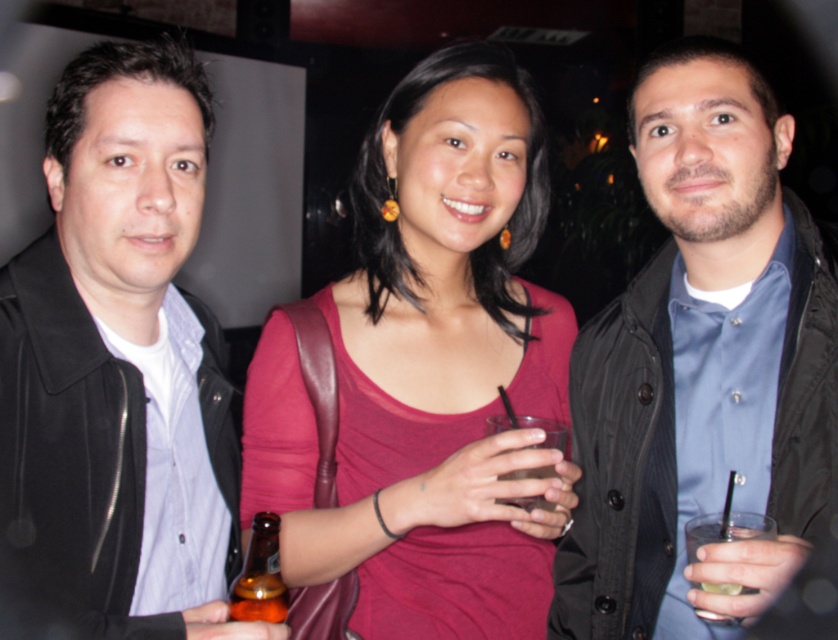
Which is behind, point (412, 448) or point (661, 252)?

The point (661, 252) is more distant.

Can you confirm if matte pink tank top at center is shorter than matte black jacket at center?

Correct, matte pink tank top at center is not as tall as matte black jacket at center.

What do you see at coordinates (428, 371) in the screenshot? I see `matte pink tank top at center` at bounding box center [428, 371].

The height and width of the screenshot is (640, 838). I want to click on matte pink tank top at center, so click(428, 371).

Is black leather jacket at left thinner than clear glass at right?

No.

You are a GUI agent. You are given a task and a screenshot of the screen. Output one action in this format:
    pyautogui.click(x=<x>, y=<y>)
    Task: Click on the black leather jacket at left
    The height and width of the screenshot is (640, 838).
    Given the screenshot: What is the action you would take?
    point(117,371)

Which is behind, point (24, 374) or point (692, 534)?

Point (24, 374)

This screenshot has width=838, height=640. I want to click on black leather jacket at left, so click(117, 371).

Which is behind, point (164, 632) or point (551, 509)?

Point (551, 509)

Does black leather jacket at left have a smaller size compared to clear glass at center?

No.

The height and width of the screenshot is (640, 838). Describe the element at coordinates (117, 371) in the screenshot. I see `black leather jacket at left` at that location.

This screenshot has width=838, height=640. What are the coordinates of `black leather jacket at left` in the screenshot? It's located at coord(117,371).